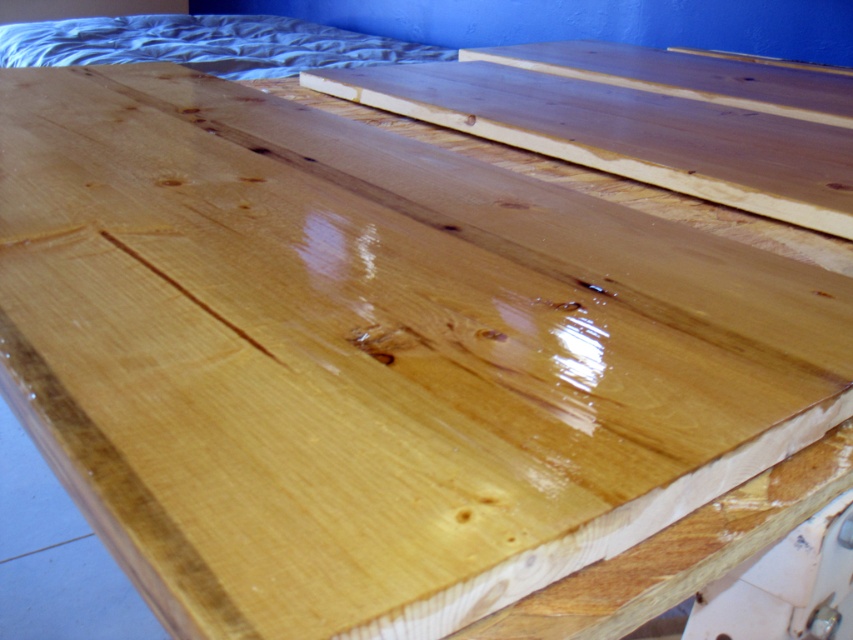
Question: Is the position of natural wood plank at upper right more distant than that of matte wood bed at upper center?

Choices:
 (A) no
 (B) yes

Answer: (A)

Question: Which object appears closest to the camera in this image?

Choices:
 (A) matte wood bed at upper center
 (B) satin wood plank at upper right

Answer: (B)

Question: Which point is closer to the camera taking this photo?

Choices:
 (A) (161, 17)
 (B) (721, 141)
 (C) (660, 54)

Answer: (B)

Question: Does matte wood bed at upper center appear on the left side of satin wood plank at upper right?

Choices:
 (A) yes
 (B) no

Answer: (A)

Question: From the image, what is the correct spatial relationship of matte wood bed at upper center in relation to satin wood plank at upper right?

Choices:
 (A) above
 (B) below

Answer: (A)

Question: Among these objects, which one is nearest to the camera?

Choices:
 (A) matte wood bed at upper center
 (B) satin wood plank at upper right

Answer: (B)